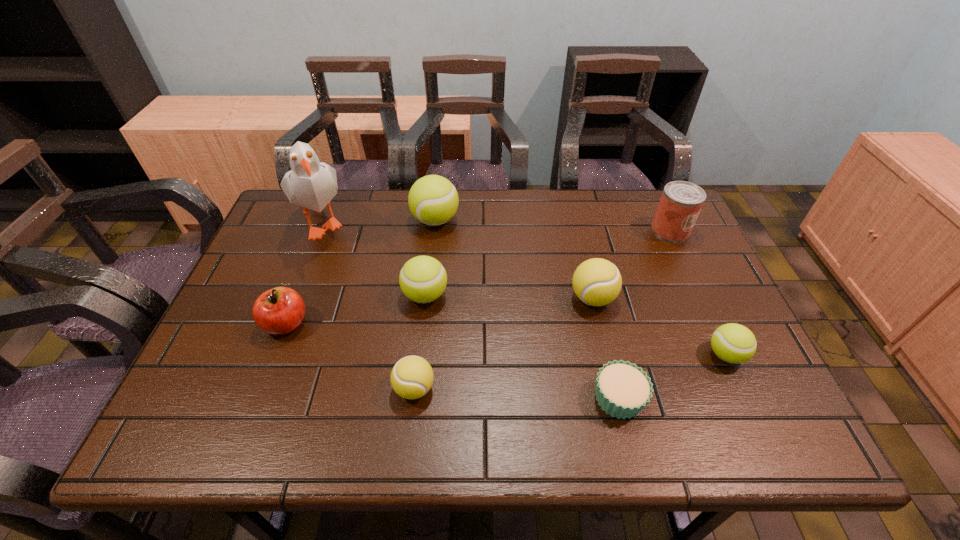
Image resolution: width=960 pixels, height=540 pixels. I want to click on vacant position located on the left of the nearest green tennis ball, so point(585,355).

Image resolution: width=960 pixels, height=540 pixels. In order to click on vacant space located on the back of the shortest object in this screenshot , I will do `click(605, 341)`.

Locate an element on the screen. The width and height of the screenshot is (960, 540). gull that is positioned at the far edge is located at coordinates (312, 184).

The height and width of the screenshot is (540, 960). Find the location of `tennis ball that is positioned at the far edge`. tennis ball that is positioned at the far edge is located at coordinates (433, 200).

Find the location of a particular element. can that is at the far edge is located at coordinates (681, 202).

The image size is (960, 540). I want to click on object present at the near edge, so click(622, 389).

I want to click on gull that is at the left edge, so click(312, 184).

Where is `apple located at the left edge`? apple located at the left edge is located at coordinates (278, 311).

Locate an element on the screen. The image size is (960, 540). can that is at the right edge is located at coordinates coord(681,202).

Identify the location of tennis ball that is positioned at the right edge. The width and height of the screenshot is (960, 540). click(x=733, y=343).